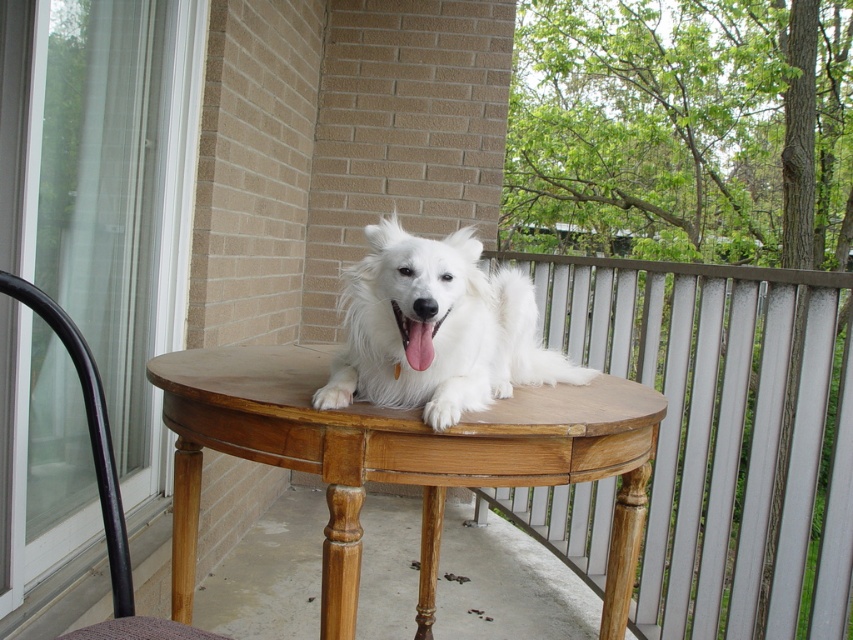
Question: Is wooden table at center below white fluffy dog at center?

Choices:
 (A) no
 (B) yes

Answer: (B)

Question: Does wooden table at center lie in front of light brown wooden table at center?

Choices:
 (A) yes
 (B) no

Answer: (B)

Question: Can you confirm if wooden table at center is smaller than white fluffy dog at center?

Choices:
 (A) no
 (B) yes

Answer: (A)

Question: Which point is closer to the camera?

Choices:
 (A) wooden table at center
 (B) light brown wooden table at center
 (C) black wood chair at left

Answer: (C)

Question: Which object is the closest to the light brown wooden table at center?

Choices:
 (A) white fluffy dog at center
 (B) wooden table at center

Answer: (A)

Question: Which is farther from the wooden table at center?

Choices:
 (A) white fluffy dog at center
 (B) light brown wooden table at center
 (C) black wood chair at left

Answer: (C)